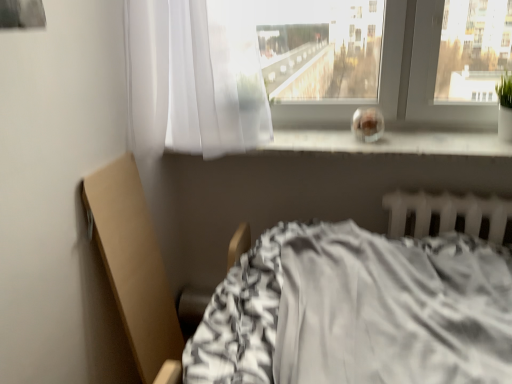
Find the location of a particular element. The image size is (512, 384). free spot above transparent glass at center (from a real-world perspective) is located at coordinates (380, 137).